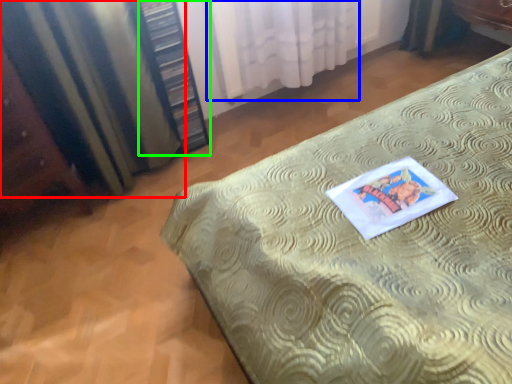
Question: Which object is positioned closest to curtain (highlighted by a red box)? Select from curtain (highlighted by a blue box) and bookshelf (highlighted by a green box).

Choices:
 (A) curtain
 (B) bookshelf

Answer: (B)